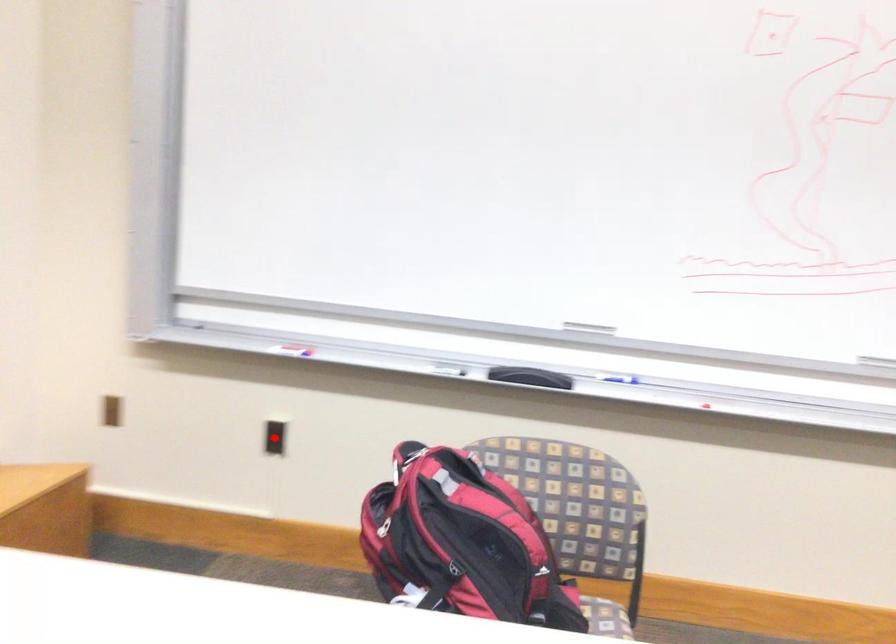
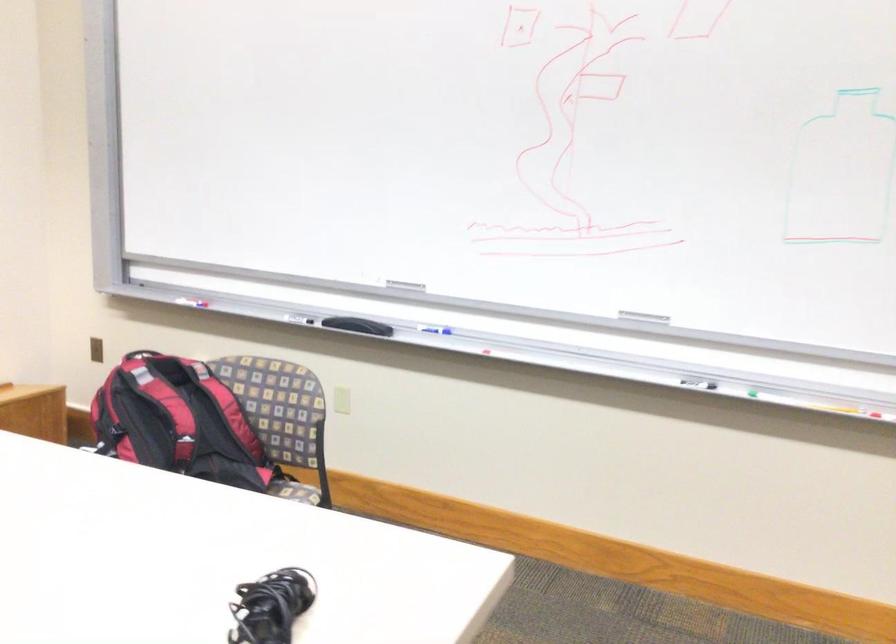
Question: I am providing you with two images of the same scene from different viewpoints. A red point is marked on the first image. Is the red point's position out of view in image 2?

Choices:
 (A) Yes
 (B) No

Answer: (A)